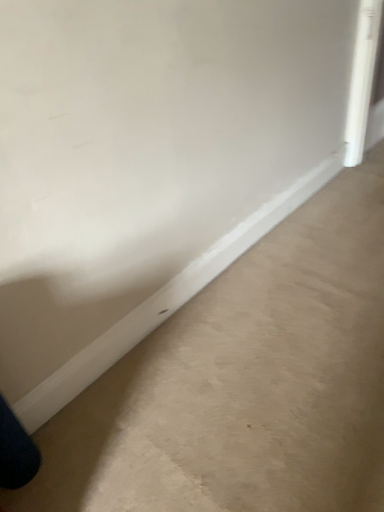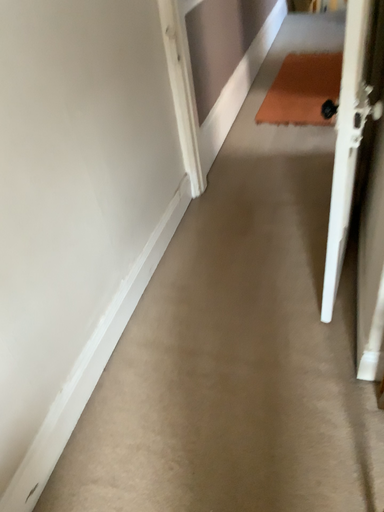
Question: Which way did the camera rotate in the video?

Choices:
 (A) rotated left
 (B) rotated right

Answer: (B)